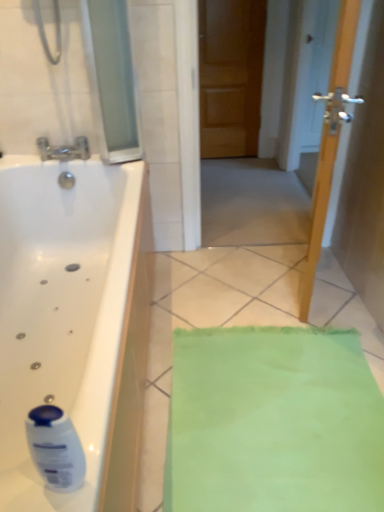
Question: Is wooden door at center looking in the opposite direction of silver metallic faucet at upper left?

Choices:
 (A) no
 (B) yes

Answer: (A)

Question: Is wooden door at center in front of silver metallic faucet at upper left?

Choices:
 (A) no
 (B) yes

Answer: (B)

Question: From a real-world perspective, is wooden door at center on top of silver metallic faucet at upper left?

Choices:
 (A) yes
 (B) no

Answer: (B)

Question: Does wooden door at center touch silver metallic faucet at upper left?

Choices:
 (A) yes
 (B) no

Answer: (B)

Question: Can you confirm if wooden door at center is wider than silver metallic faucet at upper left?

Choices:
 (A) yes
 (B) no

Answer: (B)

Question: Would you say wooden door at center is to the left or to the right of white glossy bottle at lower left in the picture?

Choices:
 (A) left
 (B) right

Answer: (B)

Question: Is point (246, 61) closer or farther from the camera than point (43, 430)?

Choices:
 (A) closer
 (B) farther

Answer: (B)

Question: From the image's perspective, is wooden door at center above or below white glossy bottle at lower left?

Choices:
 (A) below
 (B) above

Answer: (B)

Question: In terms of height, does wooden door at center look taller or shorter compared to white glossy bottle at lower left?

Choices:
 (A) tall
 (B) short

Answer: (A)

Question: In terms of size, does transparent glass door at upper left appear bigger or smaller than wooden door at center?

Choices:
 (A) small
 (B) big

Answer: (A)

Question: From the image's perspective, is transparent glass door at upper left above or below wooden door at center?

Choices:
 (A) below
 (B) above

Answer: (B)

Question: Is transparent glass door at upper left inside or outside of wooden door at center?

Choices:
 (A) inside
 (B) outside

Answer: (B)

Question: Considering the relative positions of transparent glass door at upper left and wooden door at center in the image provided, is transparent glass door at upper left to the left or to the right of wooden door at center?

Choices:
 (A) left
 (B) right

Answer: (A)

Question: Is point (213, 222) positioned closer to the camera than point (238, 29)?

Choices:
 (A) closer
 (B) farther

Answer: (A)

Question: From their relative heights in the image, would you say wooden door at center is taller or shorter than wooden door at center?

Choices:
 (A) tall
 (B) short

Answer: (A)